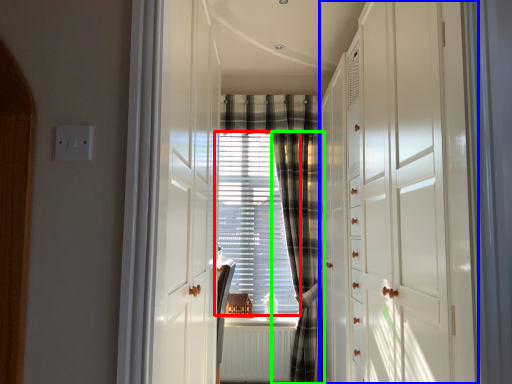
Question: Which object is positioned farthest from window screen (highlighted by a red box)? Select from dresser (highlighted by a blue box) and curtain (highlighted by a green box).

Choices:
 (A) dresser
 (B) curtain

Answer: (A)